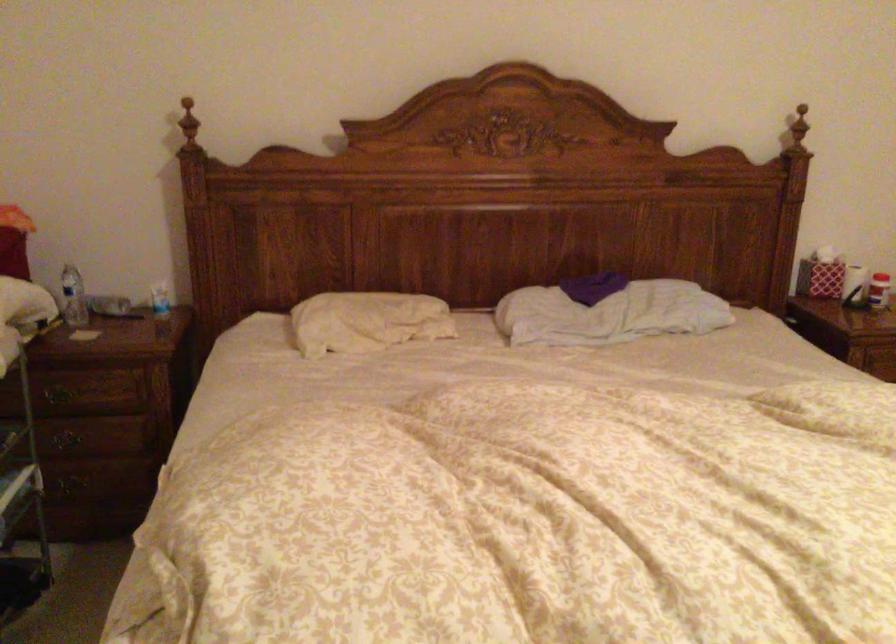
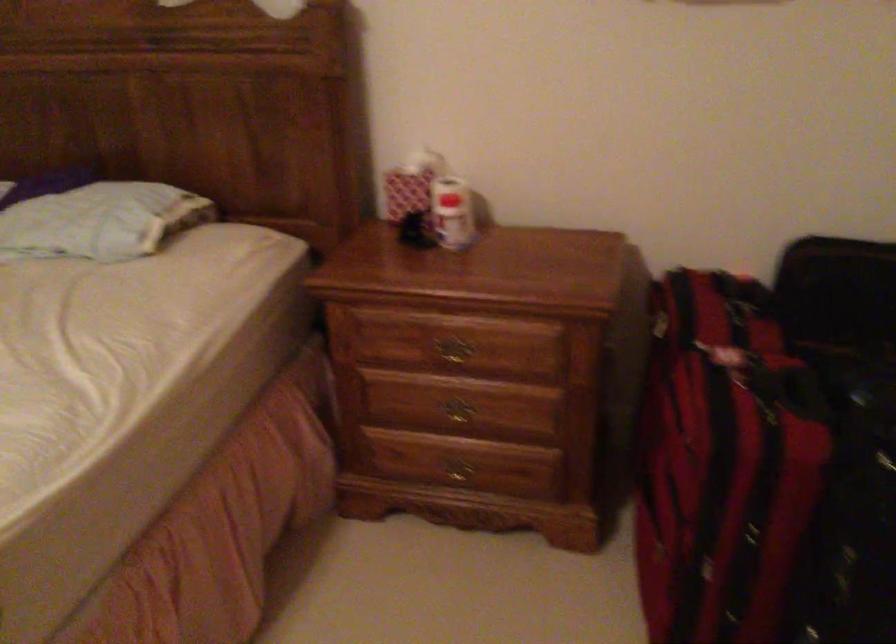
The point at (822, 261) is marked in the first image. Where is the corresponding point in the second image?

(410, 184)